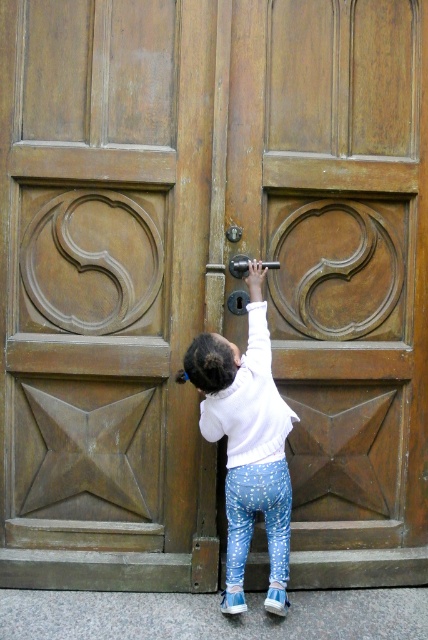
The width and height of the screenshot is (428, 640). What do you see at coordinates (246, 444) in the screenshot?
I see `white soft sweater at center` at bounding box center [246, 444].

Can you confirm if white soft sweater at center is smaller than polished brass door handle at center?

Actually, white soft sweater at center might be larger than polished brass door handle at center.

Is point (273, 609) more distant than point (205, 268)?

No, (273, 609) is in front of (205, 268).

Identify the location of white soft sweater at center. (246, 444).